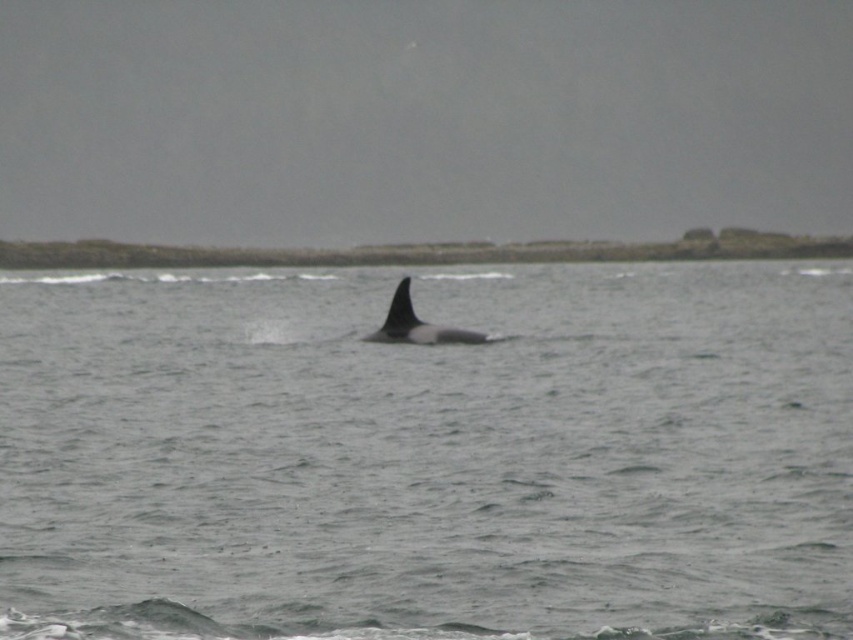
Does gray matte water at center have a lesser width compared to black smooth whale at center?

No.

What are the coordinates of `gray matte water at center` in the screenshot? It's located at (427, 454).